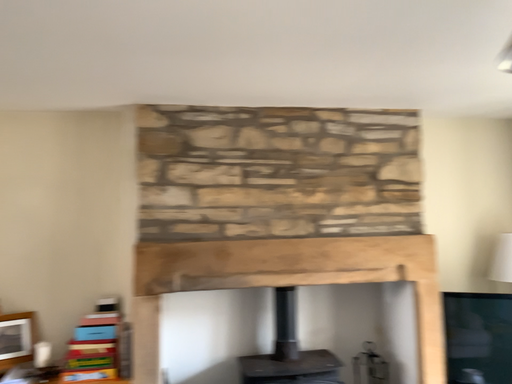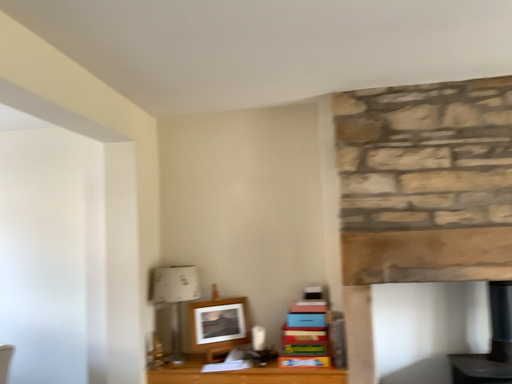
Question: Which way did the camera rotate in the video?

Choices:
 (A) rotated left
 (B) rotated right

Answer: (A)